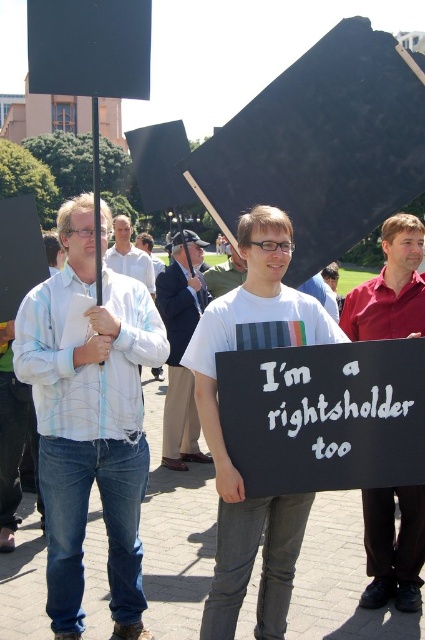
In the scene shown: You are observing a protest scene from a drone camera positioned above. There are two points marked in the image at coordinates point (215, 417) and point (190, 244). Which point is nearer to your current position?

Point (215, 417) is closer to the camera than point (190, 244).